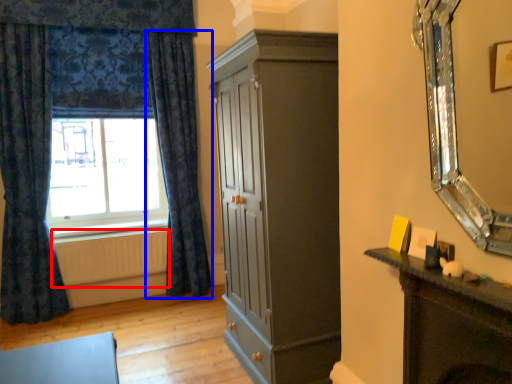
Question: Which object is further to the camera taking this photo, radiator (highlighted by a red box) or curtain (highlighted by a blue box)?

Choices:
 (A) radiator
 (B) curtain

Answer: (A)